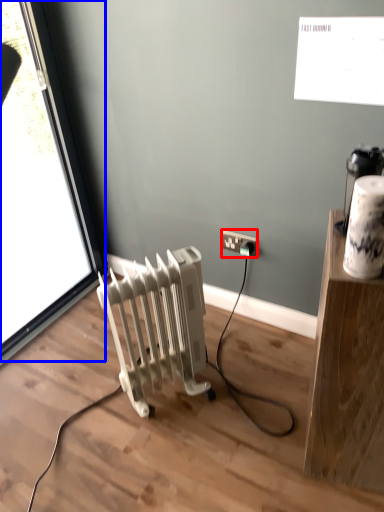
Question: Which object is further to the camera taking this photo, power plugs and sockets (highlighted by a red box) or window (highlighted by a blue box)?

Choices:
 (A) power plugs and sockets
 (B) window

Answer: (A)